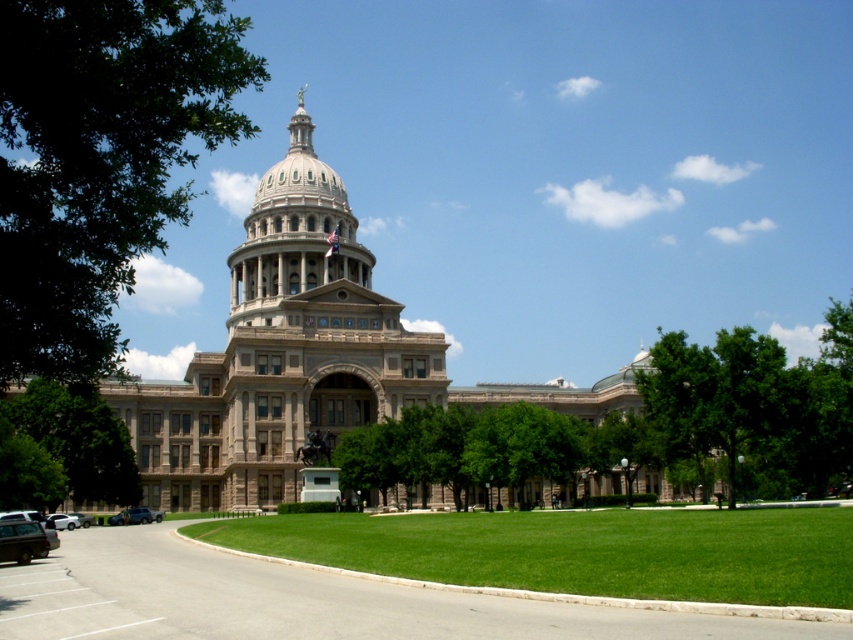
You are a visitor arriving at the state capitol. You see the green leafy tree at left and the silver metallic sedan at lower left. Which object is closer to you?

The green leafy tree at left is closer to you because it is in front of the silver metallic sedan at lower left.

You are standing on the lawn in front of the grand neoclassical building and want to walk towards the statue in the center. Which point, point [7,500] or point [84,516], is closer to you as you start walking towards the statue?

Point [7,500] is closer to the viewer than point [84,516], so it would be the first point encountered when walking towards the statue.